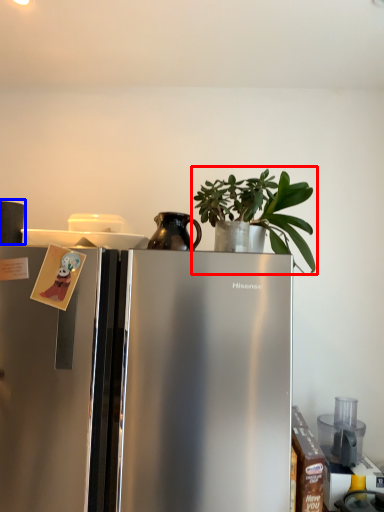
Question: Among these objects, which one is farthest to the camera, houseplant (highlighted by a red box) or appliance (highlighted by a blue box)?

Choices:
 (A) houseplant
 (B) appliance

Answer: (B)